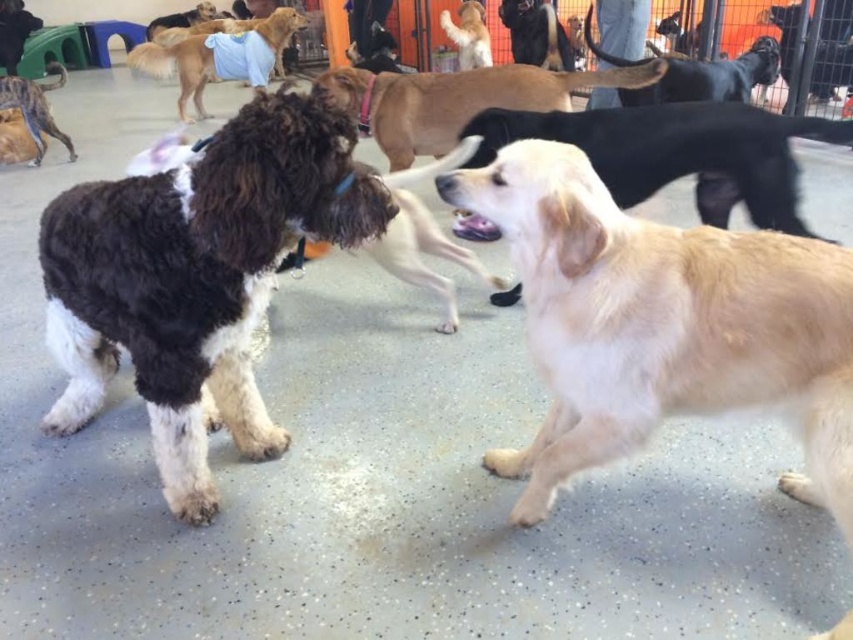
You are a dog owner trying to locate your two dogs in the daycare. You remember that one is a brown dog with a blue collar and the other is a golden dog without a collar. Based on the scene description, where is the brown fur dog at upper left in relation to the golden fur dog at upper center?

The brown fur dog at upper left is to the left of the golden fur dog at upper center.

You are standing in the dog daycare and want to pick up a toy located at point (x=581, y=304). If your reach extends 3 feet, can you grab it without moving?

The distance between you and the point (x=581, y=304) is 4.24 feet, which is beyond your 3 feet reach. You need to move closer to grab the toy.